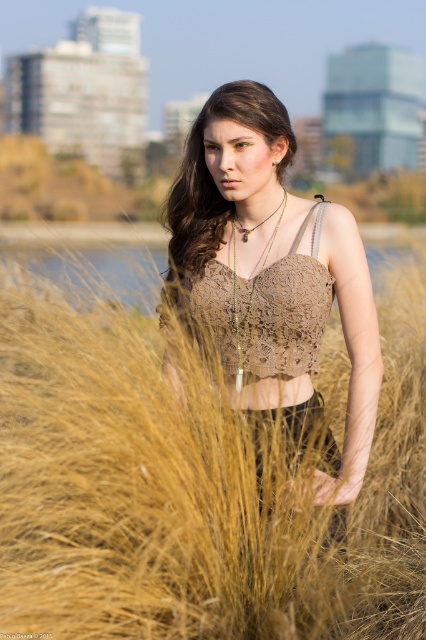
Can you confirm if brown textured reed at center is smaller than brown lace crop top at center?

Correct, brown textured reed at center occupies less space than brown lace crop top at center.

Between brown textured reed at center and brown lace crop top at center, which one is positioned higher?

brown lace crop top at center is higher up.

Is point (143, 369) closer to camera compared to point (258, 221)?

No, it is behind (258, 221).

Identify the location of brown textured reed at center. (189, 490).

Can you confirm if brown lace crop top at center is bigger than lace fabric bikini top at center?

Yes, brown lace crop top at center is bigger than lace fabric bikini top at center.

Who is taller, brown lace crop top at center or lace fabric bikini top at center?

Standing taller between the two is brown lace crop top at center.

Locate an element on the screen. This screenshot has width=426, height=640. brown lace crop top at center is located at coordinates (271, 285).

Which is above, brown lace crop top at center or brown lace top at center?

brown lace top at center is higher up.

Does brown lace crop top at center appear over brown lace top at center?

Incorrect, brown lace crop top at center is not positioned above brown lace top at center.

Who is more distant from viewer, (319, 298) or (219, 236)?

Point (219, 236)

Locate an element on the screen. The width and height of the screenshot is (426, 640). brown lace crop top at center is located at coordinates (271, 285).